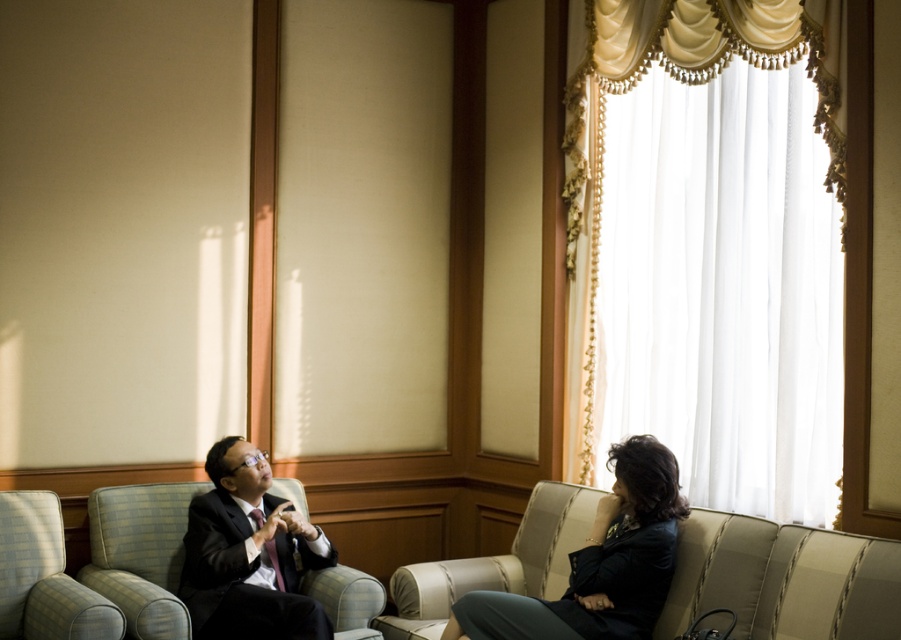
You are standing in the room where the meeting is taking place. There is a point marked at coordinates point (852, 554). If you want to move closer to this point, which direction should you move in relation to the camera?

The point (852, 554) is 2.95 meters away from the camera. To move closer to this point, you should move forward towards it from the camera position.

You are an interior designer observing the meeting scene. You need to determine the spatial relationship between the dark blue fabric jacket at lower right and the matte black suit at left. Which object is positioned higher in the image?

The dark blue fabric jacket at lower right is positioned higher than the matte black suit at left in the image.